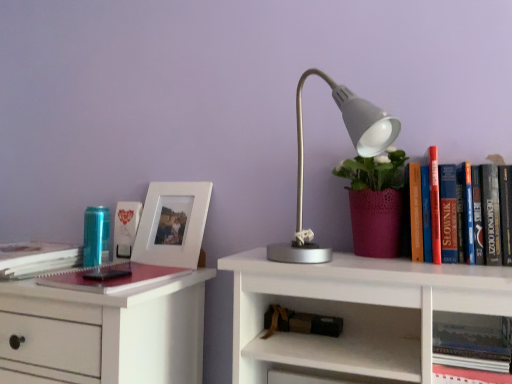
Question: Is hardcover book at upper right, which ranks as the fifth book in top-to-bottom order, positioned beyond the bounds of hardcover book at left, which appears as the 1th book when viewed from the left?

Choices:
 (A) yes
 (B) no

Answer: (A)

Question: Is hardcover book at left, which ranks as the second book in top-to-bottom order, inside hardcover book at upper right, which is the 1th book from bottom to top?

Choices:
 (A) no
 (B) yes

Answer: (A)

Question: Considering the relative positions of hardcover book at upper right, the fifth book when ordered from left to right, and hardcover book at left, the fifth book positioned from the right, in the image provided, is hardcover book at upper right, the fifth book when ordered from left to right, behind hardcover book at left, the fifth book positioned from the right,?

Choices:
 (A) no
 (B) yes

Answer: (A)

Question: From the image's perspective, is hardcover book at upper right, the fifth book when ordered from left to right, above hardcover book at left, which appears as the 1th book when viewed from the left?

Choices:
 (A) yes
 (B) no

Answer: (B)

Question: From a real-world perspective, is hardcover book at upper right, which is counted as the first book, starting from the right, located beneath hardcover book at left, which appears as the 1th book when viewed from the left?

Choices:
 (A) no
 (B) yes

Answer: (B)

Question: From the image's perspective, is hardcover book at upper right, which is the 1th book from bottom to top, beneath hardcover book at left, which ranks as the second book in top-to-bottom order?

Choices:
 (A) yes
 (B) no

Answer: (A)

Question: Is hardcover book at left, positioned as the fourth book in bottom-to-top order, to the right of hardcover book at upper right, which is the 1th book from bottom to top, from the viewer's perspective?

Choices:
 (A) yes
 (B) no

Answer: (B)

Question: Can you confirm if hardcover book at left, the fifth book positioned from the right, is smaller than hardcover book at upper right, which is the 1th book from bottom to top?

Choices:
 (A) no
 (B) yes

Answer: (A)

Question: Is the depth of hardcover book at left, which ranks as the second book in top-to-bottom order, less than that of hardcover book at upper right, which is the 1th book from bottom to top?

Choices:
 (A) no
 (B) yes

Answer: (A)

Question: From a real-world perspective, is hardcover book at left, the fifth book positioned from the right, on hardcover book at upper right, which is the 1th book from bottom to top?

Choices:
 (A) yes
 (B) no

Answer: (A)

Question: Is hardcover book at left, positioned as the fourth book in bottom-to-top order, aimed at hardcover book at upper right, which is the 1th book from bottom to top?

Choices:
 (A) yes
 (B) no

Answer: (B)

Question: Considering the relative sizes of hardcover book at left, which ranks as the second book in top-to-bottom order, and hardcover book at upper right, which is counted as the first book, starting from the right, in the image provided, is hardcover book at left, which ranks as the second book in top-to-bottom order, taller than hardcover book at upper right, which is counted as the first book, starting from the right,?

Choices:
 (A) no
 (B) yes

Answer: (B)

Question: Is matte white photo frame at left, acting as the first book starting from the top, thinner than brown leather book at lower center, which ranks as the 4th book in left-to-right order?

Choices:
 (A) no
 (B) yes

Answer: (B)